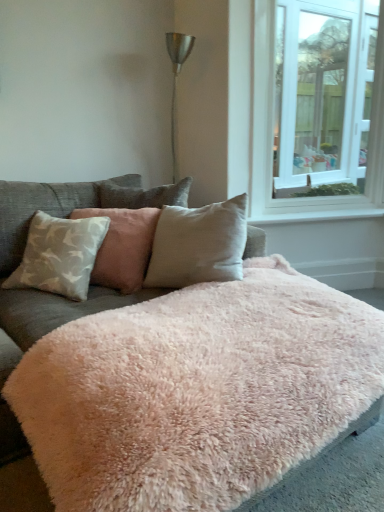
The width and height of the screenshot is (384, 512). Describe the element at coordinates (123, 246) in the screenshot. I see `light beige fabric pillow at center, marked as the 1th pillow in a right-to-left arrangement` at that location.

You are a GUI agent. You are given a task and a screenshot of the screen. Output one action in this format:
    pyautogui.click(x=<x>, y=<y>)
    Task: Click on the light beige fabric pillow at center, which is the 2th pillow in left-to-right order
    This screenshot has width=384, height=512.
    Given the screenshot: What is the action you would take?
    pyautogui.click(x=123, y=246)

Image resolution: width=384 pixels, height=512 pixels. Find the location of `fluffy pink blanket at center`. fluffy pink blanket at center is located at coordinates (65, 217).

In order to face light gray fabric pillow at left, the first pillow positioned from the left, should I rotate leftwards or rightwards?

To align with it, rotate left about 17.577°.

Where is `light gray fabric pillow at left, the first pillow positioned from the left`? light gray fabric pillow at left, the first pillow positioned from the left is located at coordinates (33, 212).

This screenshot has width=384, height=512. What are the coordinates of `white smooth window sill at upper right` in the screenshot? It's located at (316, 216).

Image resolution: width=384 pixels, height=512 pixels. In order to click on light beige fabric pillow at center, marked as the 1th pillow in a right-to-left arrangement in this screenshot , I will do `click(123, 246)`.

Are light gray fabric pillow at left, which ranks as the second pillow in right-to-left order, and white smooth window sill at upper right far apart?

light gray fabric pillow at left, which ranks as the second pillow in right-to-left order, is positioned a significant distance from white smooth window sill at upper right.

Can you confirm if light gray fabric pillow at left, the first pillow positioned from the left, is thinner than white smooth window sill at upper right?

In fact, light gray fabric pillow at left, the first pillow positioned from the left, might be wider than white smooth window sill at upper right.

Could you measure the distance between light gray fabric pillow at left, the first pillow positioned from the left, and white smooth window sill at upper right?

A distance of 3.81 feet exists between light gray fabric pillow at left, the first pillow positioned from the left, and white smooth window sill at upper right.

At what (x,y) coordinates should I click in order to perform the action: click on the 2nd pillow in front when counting from the white smooth window sill at upper right. Please return your answer as a coordinate pair (x, y). The image size is (384, 512). Looking at the image, I should click on (33, 212).

Is there a large distance between light gray fabric pillow at left, which ranks as the second pillow in right-to-left order, and light beige fabric pillow at center, marked as the 1th pillow in a right-to-left arrangement?

light gray fabric pillow at left, which ranks as the second pillow in right-to-left order, is actually quite close to light beige fabric pillow at center, marked as the 1th pillow in a right-to-left arrangement.

Can you confirm if light gray fabric pillow at left, the first pillow positioned from the left, is thinner than light beige fabric pillow at center, marked as the 1th pillow in a right-to-left arrangement?

Incorrect, the width of light gray fabric pillow at left, the first pillow positioned from the left, is not less than that of light beige fabric pillow at center, marked as the 1th pillow in a right-to-left arrangement.

Is light gray fabric pillow at left, the first pillow positioned from the left, to the left of light beige fabric pillow at center, marked as the 1th pillow in a right-to-left arrangement, from the viewer's perspective?

Indeed, light gray fabric pillow at left, the first pillow positioned from the left, is positioned on the left side of light beige fabric pillow at center, marked as the 1th pillow in a right-to-left arrangement.

Where is `pillow that appears on the left of light beige fabric pillow at center, marked as the 1th pillow in a right-to-left arrangement`? This screenshot has width=384, height=512. pillow that appears on the left of light beige fabric pillow at center, marked as the 1th pillow in a right-to-left arrangement is located at coordinates (33, 212).

Are white smooth window sill at upper right and white glass window at upper right located far from each other?

Indeed, white smooth window sill at upper right is not near white glass window at upper right.

From a real-world perspective, is white smooth window sill at upper right located higher than white glass window at upper right?

No.

Consider the image. In terms of size, does white smooth window sill at upper right appear bigger or smaller than white glass window at upper right?

Clearly, white smooth window sill at upper right is smaller in size than white glass window at upper right.

Is white smooth window sill at upper right taller or shorter than white glass window at upper right?

Considering their sizes, white smooth window sill at upper right has less height than white glass window at upper right.

From a real-world perspective, is light beige fabric pillow at center, marked as the 1th pillow in a right-to-left arrangement, over light gray fabric pillow at left, the first pillow positioned from the left?

Incorrect, from a real-world perspective, light beige fabric pillow at center, marked as the 1th pillow in a right-to-left arrangement, is lower than light gray fabric pillow at left, the first pillow positioned from the left.

Find the location of `pillow that is under the light gray fabric pillow at left, the first pillow positioned from the left (from a real-world perspective)`. pillow that is under the light gray fabric pillow at left, the first pillow positioned from the left (from a real-world perspective) is located at coordinates (123, 246).

Is light beige fabric pillow at center, marked as the 1th pillow in a right-to-left arrangement, completely or partially outside of light gray fabric pillow at left, which ranks as the second pillow in right-to-left order?

No, light beige fabric pillow at center, marked as the 1th pillow in a right-to-left arrangement, is not outside of light gray fabric pillow at left, which ranks as the second pillow in right-to-left order.

From the picture: Can you confirm if light beige fabric pillow at center, which is the 2th pillow in left-to-right order, is taller than light gray fabric pillow at left, the first pillow positioned from the left?

In fact, light beige fabric pillow at center, which is the 2th pillow in left-to-right order, may be shorter than light gray fabric pillow at left, the first pillow positioned from the left.

Which object is positioned more to the left, light beige fabric pillow at center, marked as the 1th pillow in a right-to-left arrangement, or white smooth window sill at upper right?

light beige fabric pillow at center, marked as the 1th pillow in a right-to-left arrangement, is more to the left.

Considering the positions of objects light beige fabric pillow at center, which is the 2th pillow in left-to-right order, and white smooth window sill at upper right in the image provided, who is behind, light beige fabric pillow at center, which is the 2th pillow in left-to-right order, or white smooth window sill at upper right?

white smooth window sill at upper right is further away from the camera.

Is there a large distance between light beige fabric pillow at center, which is the 2th pillow in left-to-right order, and white smooth window sill at upper right?

Yes, light beige fabric pillow at center, which is the 2th pillow in left-to-right order, and white smooth window sill at upper right are located far from each other.

Is light beige fabric pillow at center, which is the 2th pillow in left-to-right order, at the back of fluffy pink blanket at center?

Yes, fluffy pink blanket at center's orientation is away from light beige fabric pillow at center, which is the 2th pillow in left-to-right order.

Considering the sizes of objects fluffy pink blanket at center and light beige fabric pillow at center, which is the 2th pillow in left-to-right order, in the image provided, who is wider, fluffy pink blanket at center or light beige fabric pillow at center, which is the 2th pillow in left-to-right order,?

Wider between the two is fluffy pink blanket at center.

Can you confirm if fluffy pink blanket at center is bigger than light beige fabric pillow at center, which is the 2th pillow in left-to-right order?

Yes.

Is fluffy pink blanket at center with light beige fabric pillow at center, marked as the 1th pillow in a right-to-left arrangement?

No, fluffy pink blanket at center is not beside light beige fabric pillow at center, marked as the 1th pillow in a right-to-left arrangement.

Which is in front, point (2, 213) or point (42, 500)?

Positioned in front is point (42, 500).

Considering the positions of objects light gray fabric pillow at left, the first pillow positioned from the left, and fluffy pink blanket at center in the image provided, who is behind, light gray fabric pillow at left, the first pillow positioned from the left, or fluffy pink blanket at center?

light gray fabric pillow at left, the first pillow positioned from the left.

Is light gray fabric pillow at left, which ranks as the second pillow in right-to-left order, directly adjacent to fluffy pink blanket at center?

No, light gray fabric pillow at left, which ranks as the second pillow in right-to-left order, is not making contact with fluffy pink blanket at center.

From the picture: Who is smaller, light gray fabric pillow at left, which ranks as the second pillow in right-to-left order, or fluffy pink blanket at center?

light gray fabric pillow at left, which ranks as the second pillow in right-to-left order, is smaller.

You are a GUI agent. You are given a task and a screenshot of the screen. Output one action in this format:
    pyautogui.click(x=<x>, y=<y>)
    Task: Click on the 2nd pillow located above the white smooth window sill at upper right (from a real-world perspective)
    
    Given the screenshot: What is the action you would take?
    click(33, 212)

Locate an element on the screen. This screenshot has width=384, height=512. pillow behind the light gray fabric pillow at left, the first pillow positioned from the left is located at coordinates (123, 246).

When comparing their distances from white glass window at upper right, does light beige fabric pillow at center, marked as the 1th pillow in a right-to-left arrangement, or fluffy pink blanket at center seem further?

Among the two, fluffy pink blanket at center is located further to white glass window at upper right.

From the image, which object appears to be nearer to fluffy pink blanket at center, white smooth window sill at upper right or light gray fabric pillow at left, the first pillow positioned from the left?

light gray fabric pillow at left, the first pillow positioned from the left, lies closer to fluffy pink blanket at center than the other object.

Based on their spatial positions, is white smooth window sill at upper right or fluffy pink blanket at center closer to light beige fabric pillow at center, marked as the 1th pillow in a right-to-left arrangement?

Among the two, fluffy pink blanket at center is located nearer to light beige fabric pillow at center, marked as the 1th pillow in a right-to-left arrangement.

Looking at the image, which one is located closer to light beige fabric pillow at center, marked as the 1th pillow in a right-to-left arrangement, light gray fabric pillow at left, the first pillow positioned from the left, or white smooth window sill at upper right?

light gray fabric pillow at left, the first pillow positioned from the left, lies closer to light beige fabric pillow at center, marked as the 1th pillow in a right-to-left arrangement, than the other object.

Looking at this image, from the image, which object appears to be farther from light beige fabric pillow at center, which is the 2th pillow in left-to-right order, fluffy pink blanket at center or light gray fabric pillow at left, the first pillow positioned from the left?

The object further to light beige fabric pillow at center, which is the 2th pillow in left-to-right order, is light gray fabric pillow at left, the first pillow positioned from the left.

Which object lies nearer to the anchor point white glass window at upper right, white smooth window sill at upper right or fluffy pink blanket at center?

white smooth window sill at upper right.

In the scene shown: Which object lies nearer to the anchor point fluffy pink blanket at center, light gray fabric pillow at left, which ranks as the second pillow in right-to-left order, or light beige fabric pillow at center, marked as the 1th pillow in a right-to-left arrangement?

light gray fabric pillow at left, which ranks as the second pillow in right-to-left order, is positioned closer to the anchor fluffy pink blanket at center.

In the scene shown: Estimate the real-world distances between objects in this image. Which object is closer to light gray fabric pillow at left, which ranks as the second pillow in right-to-left order, white smooth window sill at upper right or light beige fabric pillow at center, marked as the 1th pillow in a right-to-left arrangement?

light beige fabric pillow at center, marked as the 1th pillow in a right-to-left arrangement.

At what (x,y) coordinates should I click in order to perform the action: click on window sill situated between light gray fabric pillow at left, the first pillow positioned from the left, and white glass window at upper right from left to right. Please return your answer as a coordinate pair (x, y). Image resolution: width=384 pixels, height=512 pixels. Looking at the image, I should click on (316, 216).

At what (x,y) coordinates should I click in order to perform the action: click on pillow between light gray fabric pillow at left, which ranks as the second pillow in right-to-left order, and white glass window at upper right, in the horizontal direction. Please return your answer as a coordinate pair (x, y). The height and width of the screenshot is (512, 384). Looking at the image, I should click on (123, 246).

At what (x,y) coordinates should I click in order to perform the action: click on window between fluffy pink blanket at center and white smooth window sill at upper right along the z-axis. Please return your answer as a coordinate pair (x, y). The width and height of the screenshot is (384, 512). Looking at the image, I should click on (316, 106).

This screenshot has width=384, height=512. I want to click on window sill between light beige fabric pillow at center, marked as the 1th pillow in a right-to-left arrangement, and white glass window at upper right, so click(x=316, y=216).